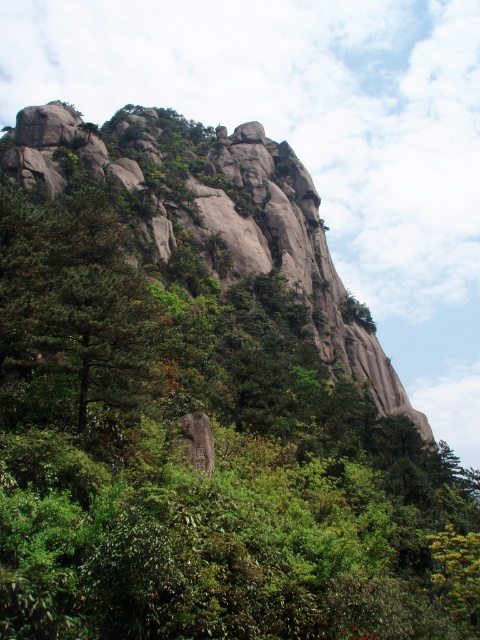
Locate an element on the screen. The width and height of the screenshot is (480, 640). green matte tree at left is located at coordinates click(x=75, y=316).

Measure the distance between green matte tree at left and rough gray rock at center.

green matte tree at left is 59.91 feet away from rough gray rock at center.

Does point (96, 227) come in front of point (206, 444)?

No, it is behind (206, 444).

Image resolution: width=480 pixels, height=640 pixels. In order to click on green matte tree at left in this screenshot , I will do `click(75, 316)`.

Between gray rock at upper center and green matte tree at left, which one has more height?

Standing taller between the two is gray rock at upper center.

Is point (383, 385) closer to viewer compared to point (87, 304)?

No, (383, 385) is behind (87, 304).

Is point (163, 227) closer to viewer compared to point (67, 344)?

No, it is behind (67, 344).

What are the coordinates of `gray rock at upper center` in the screenshot? It's located at 206,218.

Is gray rock at upper center positioned behind rough gray rock at center?

No, gray rock at upper center is closer to the viewer.

Who is lower down, gray rock at upper center or rough gray rock at center?

rough gray rock at center is below.

Is point (297, 282) positioned in front of point (201, 448)?

No.

This screenshot has width=480, height=640. In order to click on gray rock at upper center in this screenshot , I will do `click(206, 218)`.